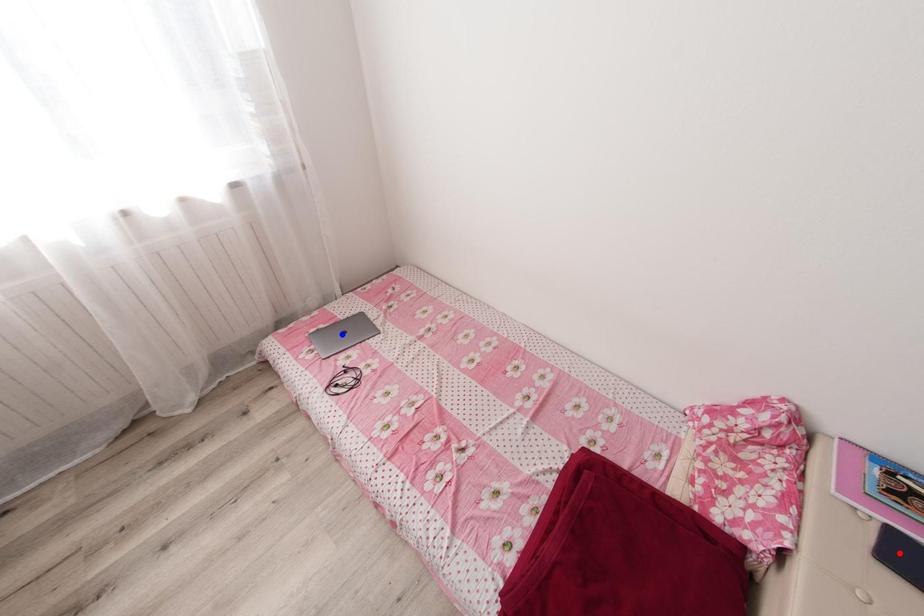
Question: Two points are marked on the image. Which point is closer to the camera?

Choices:
 (A) Blue point is closer.
 (B) Red point is closer.

Answer: (B)